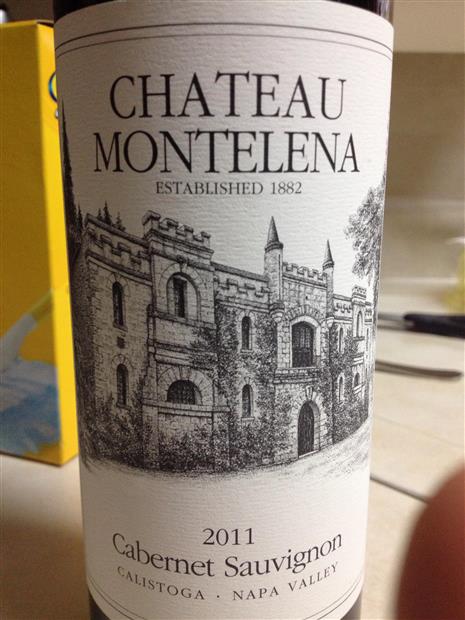
This screenshot has height=620, width=465. What are the coordinates of `dark tan wall lower` in the screenshot? It's located at (425, 64), (426, 157).